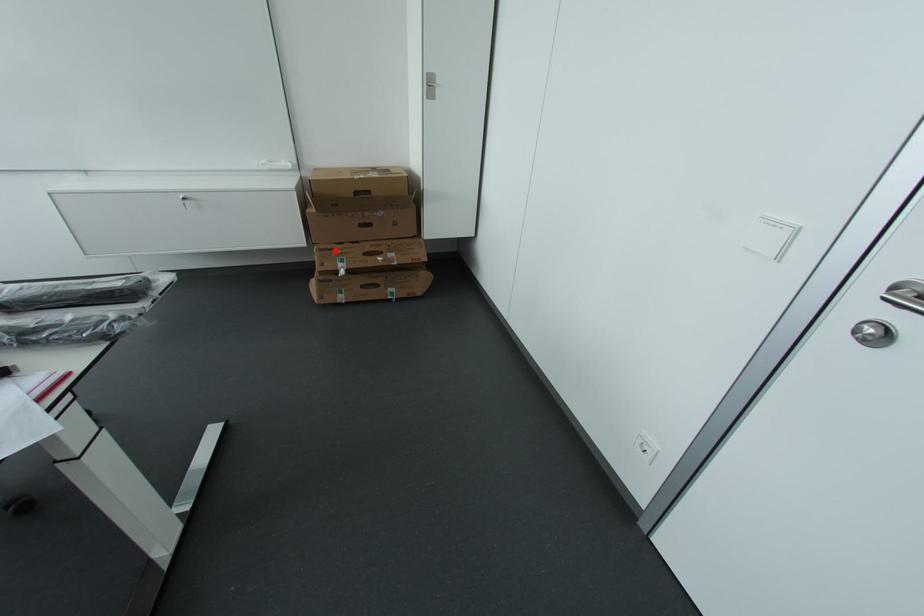
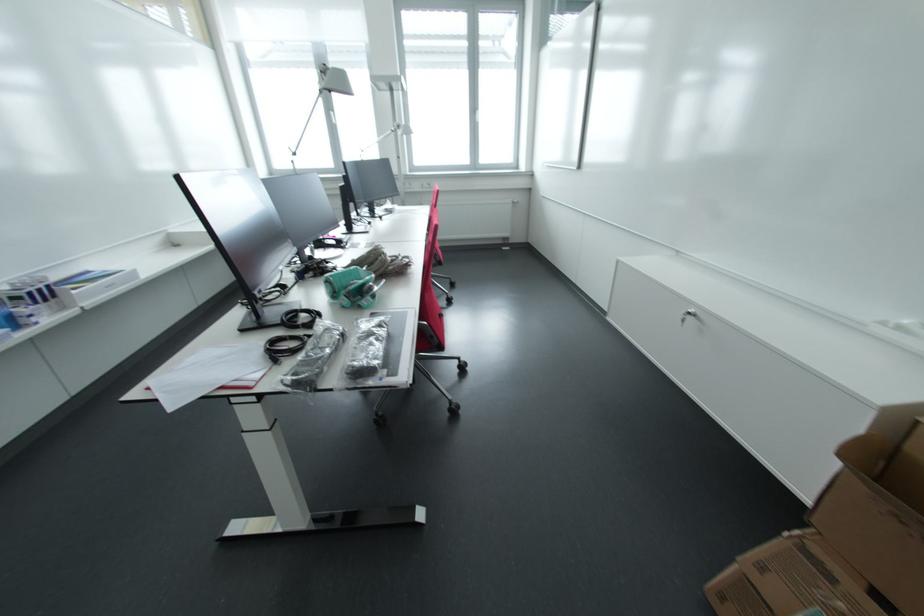
In the second image, find the point that corresponds to the highlighted location in the first image.

(833, 578)